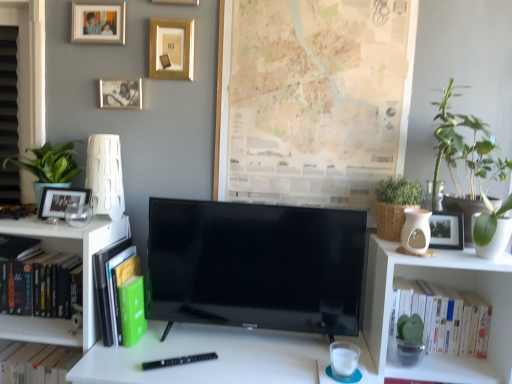
Question: Which is correct: green leafy plant at upper right is inside white matte book at right, which is the first book from right to left, or outside of it?

Choices:
 (A) outside
 (B) inside

Answer: (A)

Question: From the image's perspective, is green leafy plant at upper right positioned above or below white matte book at right, which is the first book from right to left?

Choices:
 (A) above
 (B) below

Answer: (A)

Question: Estimate the real-world distances between objects in this image. Which object is closer to the green leafy plant at right, which is the first houseplant in right-to-left order?

Choices:
 (A) green matte plant at left, which is counted as the 3th houseplant, starting from the right
 (B) green leafy plant at upper right
 (C) white matte book at right, which is the first book from right to left
 (D) green matte flowerpot at right
 (E) matte gold picture frame at upper left, the 2th picture frame in the top-to-bottom sequence

Answer: (B)

Question: Estimate the real-world distances between objects in this image. Which object is closer to the matte gold picture frame at upper left, the 2th picture frame in the top-to-bottom sequence?

Choices:
 (A) green matte book at left, the second book from the right
 (B) hardcover book at left, placed as the 3th book when sorted from right to left
 (C) beige paper map at upper center
 (D) green leafy plant at right, which is counted as the third houseplant, starting from the left
 (E) matte black picture frame at left, marked as the 1th picture frame in a bottom-to-top arrangement

Answer: (E)